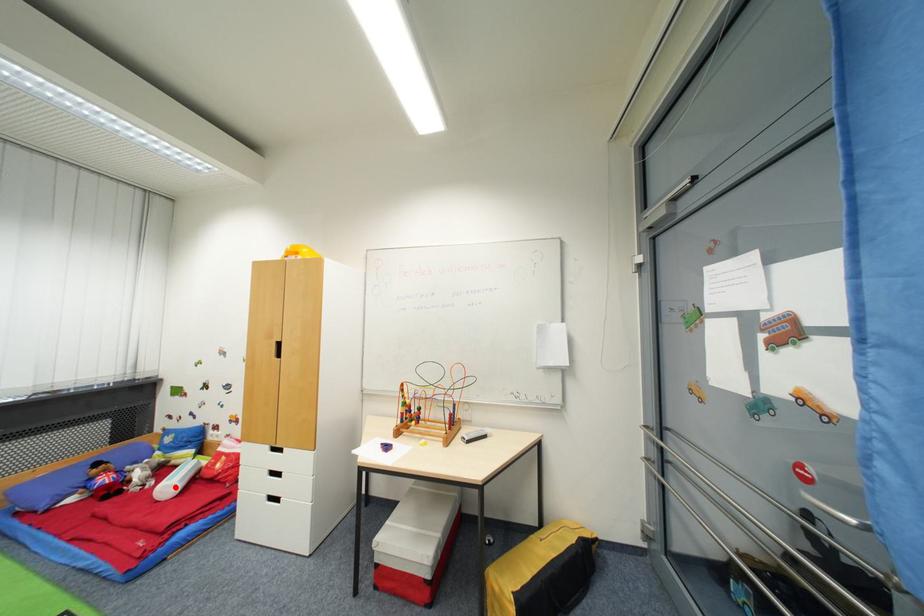
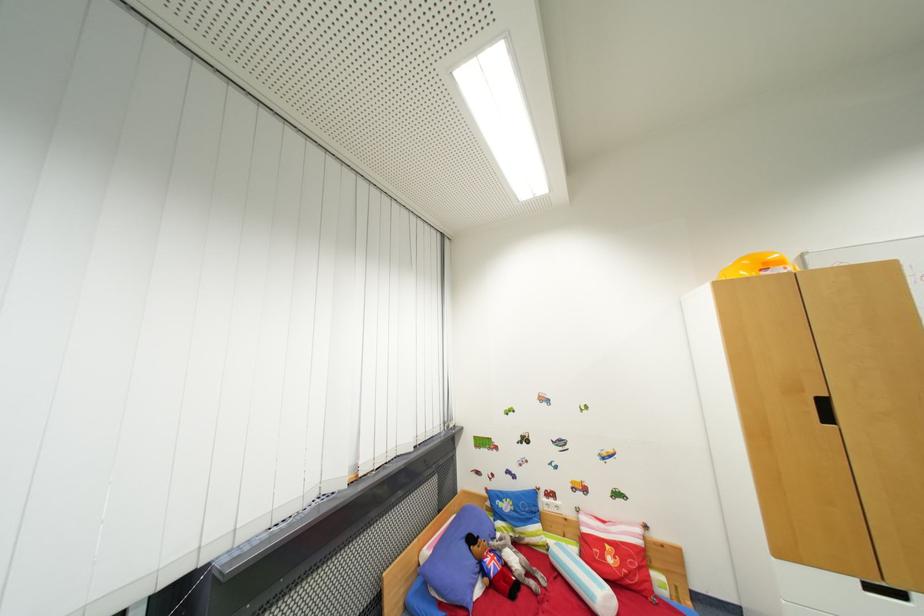
Question: I am providing you with two images of the same scene from different viewpoints. A red point is marked on the first image. Can you still see the location of the red point in image 2?

Choices:
 (A) Yes
 (B) No

Answer: (A)